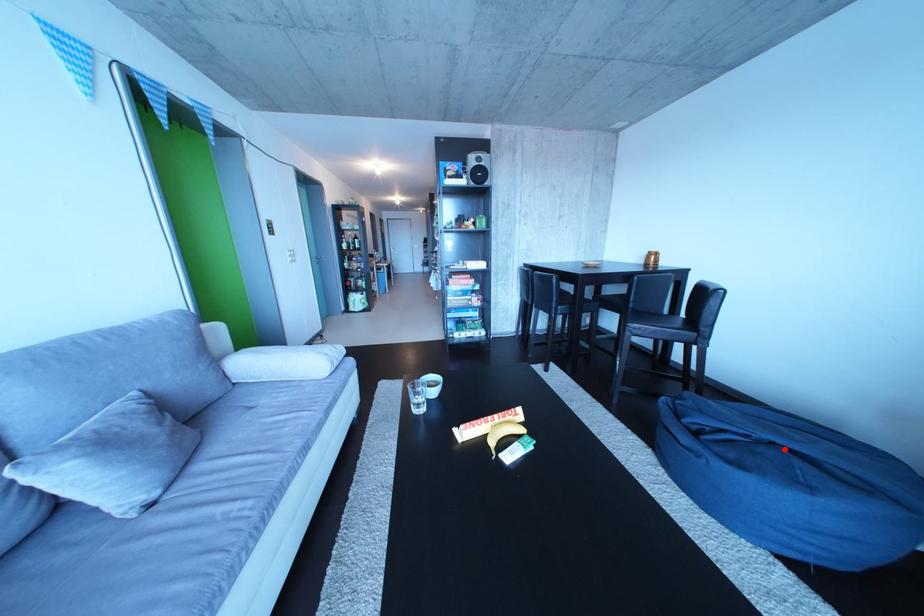
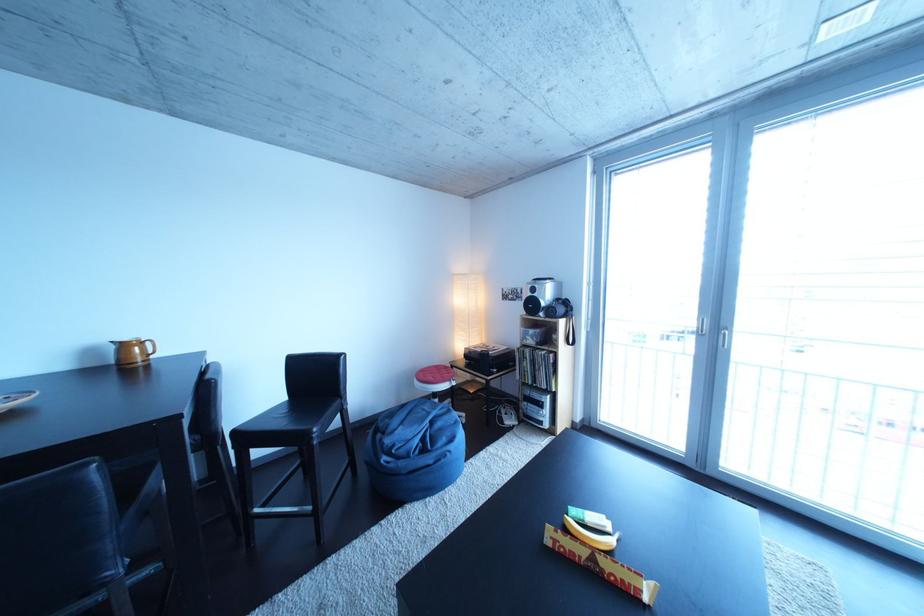
Question: A red point is marked in image1. In image2, is the corresponding 3D point closer to the camera or farther? Reply with the corresponding letter.

Choices:
 (A) The corresponding 3D point is closer.
 (B) The corresponding 3D point is farther.

Answer: (A)